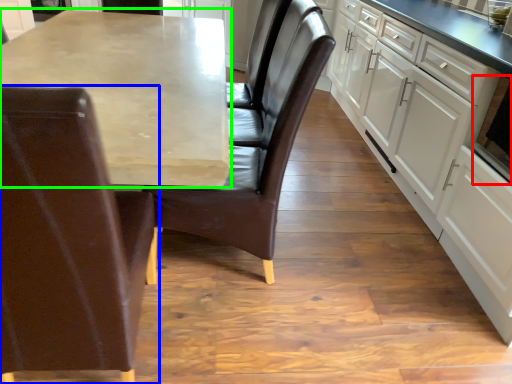
Question: Considering the real-world distances, which object is farthest from appliance (highlighted by a red box)? chair (highlighted by a blue box) or countertop (highlighted by a green box)?

Choices:
 (A) chair
 (B) countertop

Answer: (A)